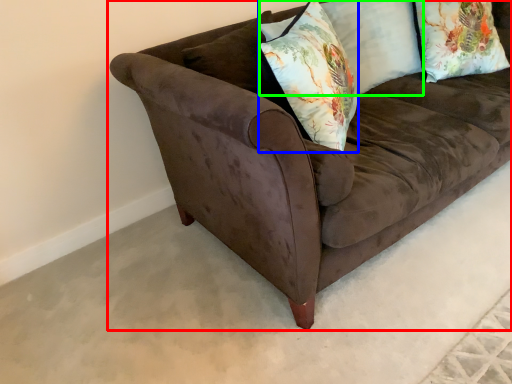
Question: Based on their relative distances, which object is nearer to studio couch (highlighted by a red box)? Choose from throw pillow (highlighted by a blue box) and pillow (highlighted by a green box).

Choices:
 (A) throw pillow
 (B) pillow

Answer: (A)